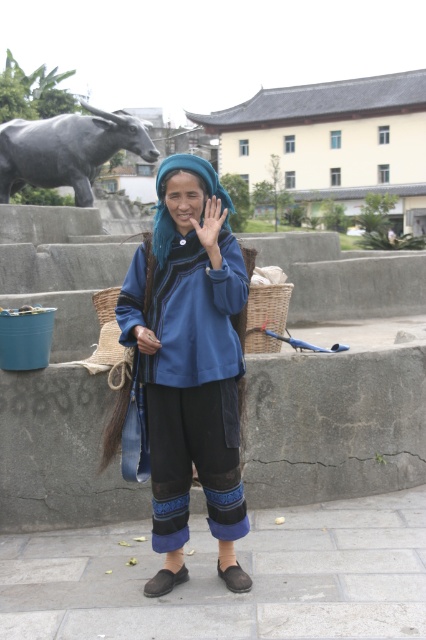
Is gray metallic bull at upper left positioned in front of woven straw basket at lower left?

No, it is not.

The image size is (426, 640). Describe the element at coordinates (68, 148) in the screenshot. I see `gray metallic bull at upper left` at that location.

Locate an element on the screen. Image resolution: width=426 pixels, height=640 pixels. gray metallic bull at upper left is located at coordinates (68, 148).

Is blue woven fabric at center bigger than gray metallic bull at upper left?

No.

Is blue woven fabric at center in front of gray metallic bull at upper left?

Yes, blue woven fabric at center is in front of gray metallic bull at upper left.

The width and height of the screenshot is (426, 640). In order to click on blue woven fabric at center in this screenshot , I will do `click(189, 364)`.

Where is `blue woven fabric at center`? The image size is (426, 640). blue woven fabric at center is located at coordinates (189, 364).

Can you confirm if blue woven fabric at center is positioned below woven brown basket at lower center?

Yes, blue woven fabric at center is below woven brown basket at lower center.

Does point (167, 248) lie in front of point (284, 324)?

Yes, it is.

The width and height of the screenshot is (426, 640). I want to click on blue woven fabric at center, so click(189, 364).

What are the coordinates of `blue woven fabric at center` in the screenshot? It's located at (189, 364).